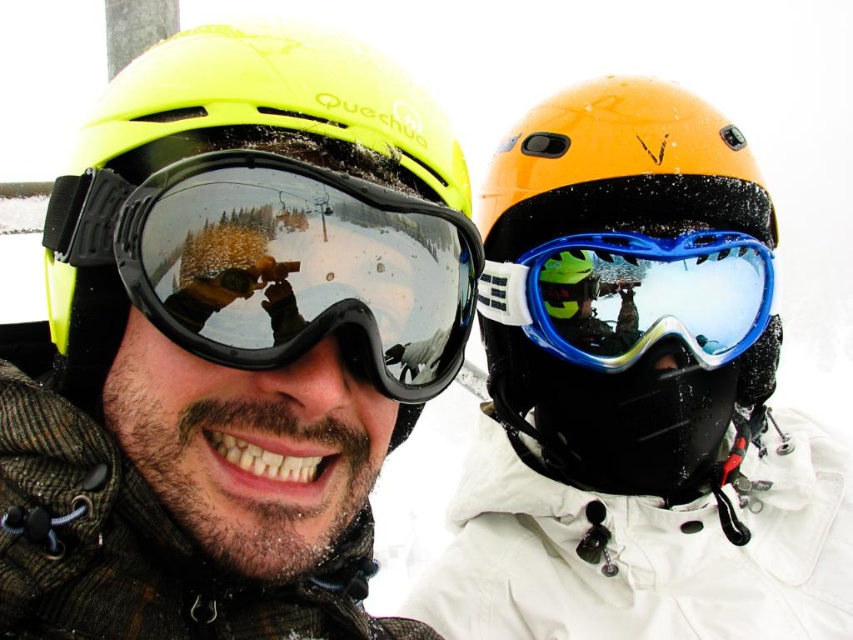
Question: Which point appears farthest from the camera in this image?

Choices:
 (A) (267, 634)
 (B) (376, 268)
 (C) (537, 317)

Answer: (C)

Question: Is matte yellow helmet at center closer to camera compared to matte black goggles at left?

Choices:
 (A) no
 (B) yes

Answer: (B)

Question: Is orange matte helmet at upper right positioned at the back of matte black goggles at left?

Choices:
 (A) no
 (B) yes

Answer: (B)

Question: Estimate the real-world distances between objects in this image. Which object is farther from the matte black goggles at left?

Choices:
 (A) blue glossy ski goggles at center
 (B) matte yellow helmet at center

Answer: (A)

Question: Among these points, which one is nearest to the camera?

Choices:
 (A) (x=670, y=230)
 (B) (x=757, y=310)
 (C) (x=192, y=214)
 (D) (x=4, y=362)

Answer: (C)

Question: Can you confirm if orange matte helmet at upper right is positioned to the left of blue glossy ski goggles at center?

Choices:
 (A) yes
 (B) no

Answer: (B)